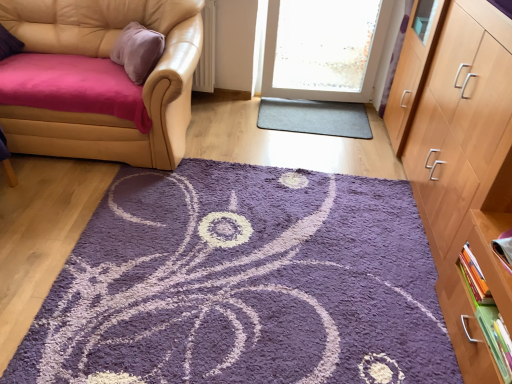
Question: Does matte purple book at right, which appears as the first book when viewed from the top, have a lesser height compared to light brown wood cabinet at right?

Choices:
 (A) yes
 (B) no

Answer: (A)

Question: From a real-world perspective, is matte purple book at right, which appears as the first book when viewed from the top, positioned under light brown wood cabinet at right based on gravity?

Choices:
 (A) yes
 (B) no

Answer: (A)

Question: Considering the relative sizes of matte purple book at right, positioned as the 3th book in bottom-to-top order, and light brown wood cabinet at right in the image provided, is matte purple book at right, positioned as the 3th book in bottom-to-top order, bigger than light brown wood cabinet at right?

Choices:
 (A) yes
 (B) no

Answer: (B)

Question: Is matte purple book at right, positioned as the 3th book in bottom-to-top order, looking in the opposite direction of light brown wood cabinet at right?

Choices:
 (A) yes
 (B) no

Answer: (B)

Question: Does matte purple book at right, which appears as the first book when viewed from the top, have a lesser width compared to light brown wood cabinet at right?

Choices:
 (A) yes
 (B) no

Answer: (A)

Question: Is leather couch at left smaller than green matte book at lower right, which is counted as the first book, starting from the bottom?

Choices:
 (A) no
 (B) yes

Answer: (A)

Question: Can you see leather couch at left touching green matte book at lower right, which is counted as the first book, starting from the bottom?

Choices:
 (A) no
 (B) yes

Answer: (A)

Question: Can green matte book at lower right, which ranks as the 3th book in top-to-bottom order, be found inside leather couch at left?

Choices:
 (A) no
 (B) yes

Answer: (A)

Question: Can you confirm if leather couch at left is bigger than green matte book at lower right, which is counted as the first book, starting from the bottom?

Choices:
 (A) yes
 (B) no

Answer: (A)

Question: Could you tell me if leather couch at left is turned towards green matte book at lower right, which is counted as the first book, starting from the bottom?

Choices:
 (A) yes
 (B) no

Answer: (B)

Question: Does leather couch at left have a greater width compared to green matte book at lower right, which ranks as the 3th book in top-to-bottom order?

Choices:
 (A) yes
 (B) no

Answer: (A)

Question: Does gray rubber mat at center have a greater width compared to light brown wood cabinet at right?

Choices:
 (A) yes
 (B) no

Answer: (B)